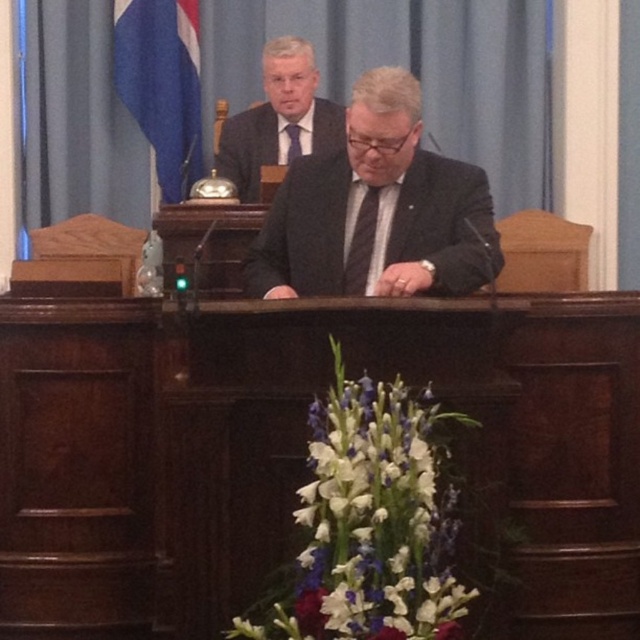
Can you confirm if blue fabric flag at upper left is wider than black silk tie at center?

Yes, blue fabric flag at upper left is wider than black silk tie at center.

Is point (196, 29) positioned in front of point (368, 257)?

No, (196, 29) is further to viewer.

Who is more distant from viewer, [170,93] or [369,188]?

The point [170,93] is behind.

This screenshot has height=640, width=640. Find the location of `blue fabric flag at upper left`. blue fabric flag at upper left is located at coordinates (163, 84).

This screenshot has height=640, width=640. What are the coordinates of `dark wood podium at center` in the screenshot? It's located at (301, 451).

Does dark wood podium at center have a lesser height compared to purple silk tie at center?

No, dark wood podium at center is not shorter than purple silk tie at center.

Is point (214, 634) positioned after point (291, 154)?

No, it is not.

You are a GUI agent. You are given a task and a screenshot of the screen. Output one action in this format:
    pyautogui.click(x=<x>, y=<y>)
    Task: Click on the dark wood podium at center
    
    Given the screenshot: What is the action you would take?
    pyautogui.click(x=301, y=451)

Between point (180, 141) and point (256, 189), which one is positioned in front?

Positioned in front is point (256, 189).

Does blue fabric flag at upper left have a larger size compared to satin black suit at upper center?

Actually, blue fabric flag at upper left might be smaller than satin black suit at upper center.

Locate an element on the screen. The width and height of the screenshot is (640, 640). blue fabric flag at upper left is located at coordinates (163, 84).

This screenshot has width=640, height=640. In order to click on blue fabric flag at upper left in this screenshot , I will do `click(163, 84)`.